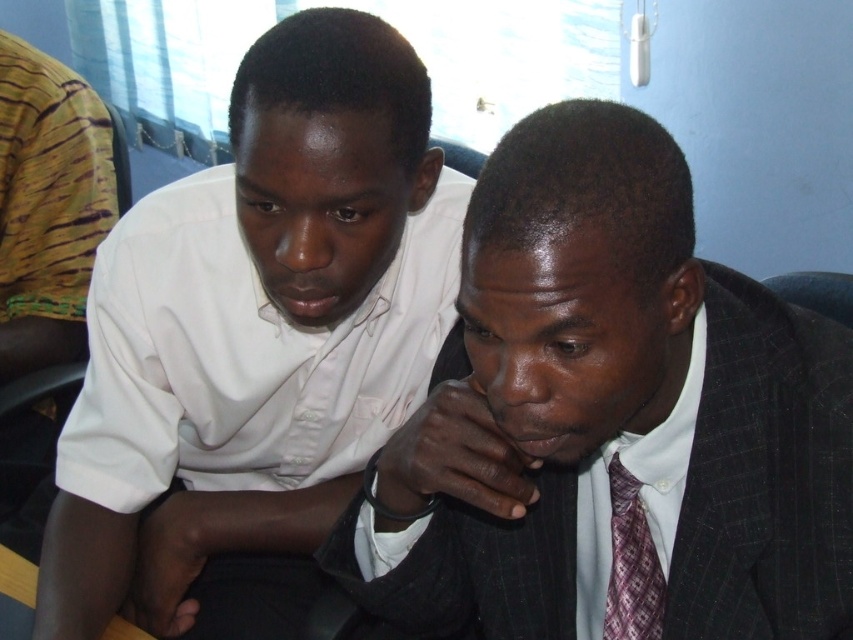
Consider the image. You are a photographer setting up a shoot in the room. You need to position a light source to the left of the white shirt at left and to the right of the plaid silk tie at center. Is this possible based on their positions?

The white shirt at left is to the left of the plaid silk tie at center, so placing a light source to the left of the white shirt at left and to the right of the plaid silk tie at center would not be possible because the white shirt is already positioned to the left of the tie.

You are a photographer standing behind the two people in the image. You want to take a photo of the dark gray suit at center without the white shirt at left appearing in the background. Is it possible to do so based on their positions?

The dark gray suit at center is in front of the white shirt at left, so if you position yourself directly behind the dark gray suit at center, the white shirt at left would be obscured and not visible in the background.

You are organizing a charity event and need to decide which item to donate based on size. You have the white shirt at left and the plaid silk tie at center. Which item would require more space when packing?

The white shirt at left requires more space when packing because it has a larger size compared to the plaid silk tie at center.